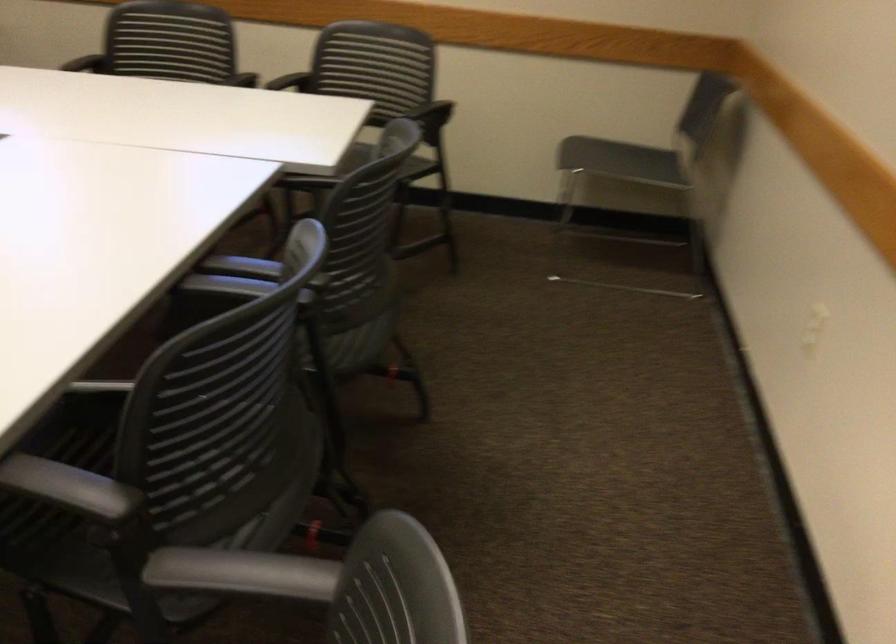
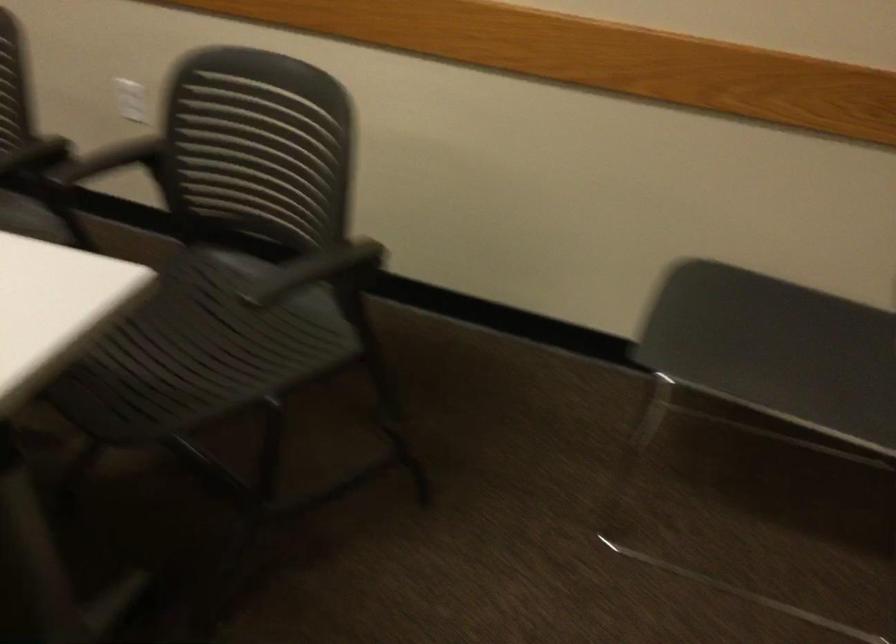
Where in the second image is the point corresponding to (246,79) from the first image?

(35, 156)